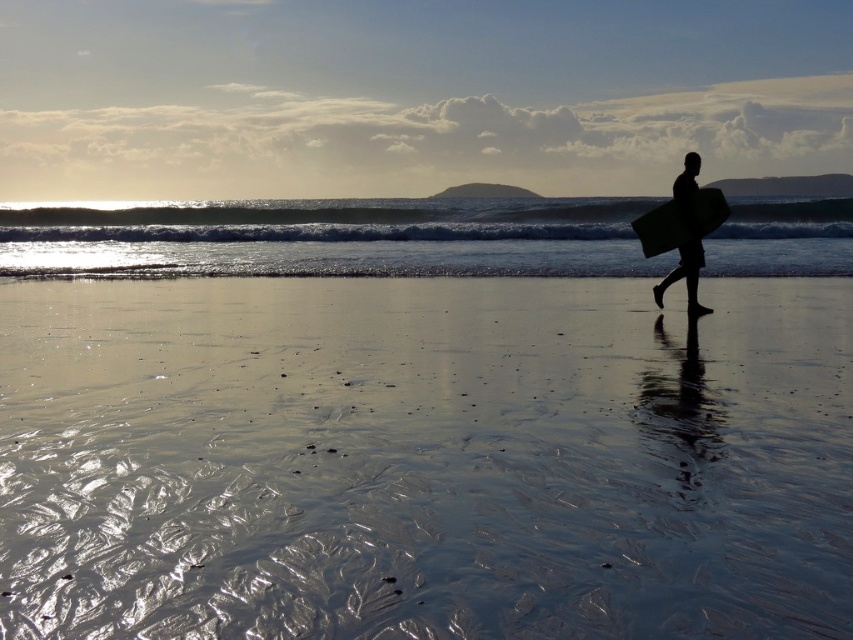
Question: Among these objects, which one is nearest to the camera?

Choices:
 (A) shiny sand at lower center
 (B) clear blue water at center

Answer: (A)

Question: Based on their relative distances, which object is nearer to the black matte surfboard at right?

Choices:
 (A) shiny sand at lower center
 (B) smooth black surfboard at right
 (C) clear blue water at center

Answer: (B)

Question: Which object is the farthest from the black matte surfboard at right?

Choices:
 (A) shiny sand at lower center
 (B) clear blue water at center
 (C) smooth black surfboard at right

Answer: (B)

Question: Does clear blue water at center come in front of smooth black surfboard at right?

Choices:
 (A) no
 (B) yes

Answer: (A)

Question: Can you confirm if black matte surfboard at right is positioned below smooth black surfboard at right?

Choices:
 (A) no
 (B) yes

Answer: (B)

Question: Does clear blue water at center appear on the right side of smooth black surfboard at right?

Choices:
 (A) yes
 (B) no

Answer: (B)